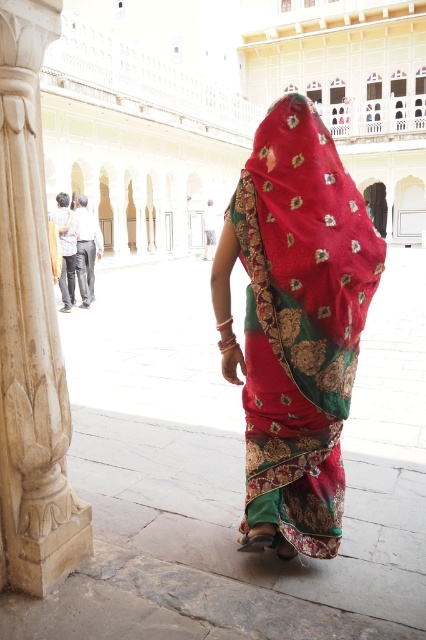
Question: Which of the following is the closest to the observer?

Choices:
 (A) white marble pillar at left
 (B) matte black pants at center

Answer: (A)

Question: Can you confirm if matte black pants at center is wider than matte black robe at left?

Choices:
 (A) no
 (B) yes

Answer: (A)

Question: Among these objects, which one is farthest from the camera?

Choices:
 (A) matte silk saree at center
 (B) matte black robe at left
 (C) matte black pants at center
 (D) white marble pillar at left

Answer: (C)

Question: Can you confirm if white marble pillar at left is positioned to the left of matte black pants at center?

Choices:
 (A) yes
 (B) no

Answer: (B)

Question: Among these objects, which one is nearest to the camera?

Choices:
 (A) white marble pillar at left
 (B) matte black pants at center

Answer: (A)

Question: Is matte silk saree at center wider than white marble pillar at left?

Choices:
 (A) no
 (B) yes

Answer: (B)